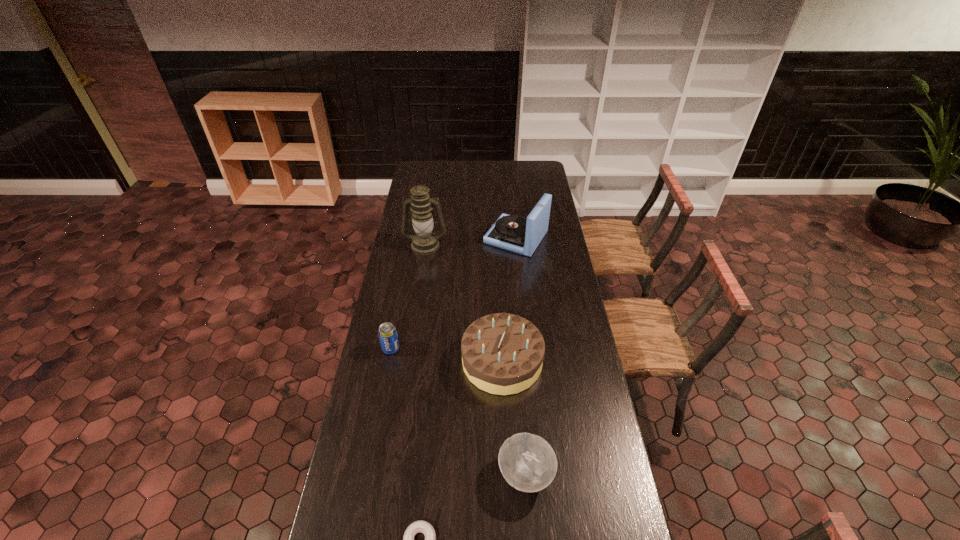
Locate an element on the screen. free space between the fifth farthest object and the third tallest object is located at coordinates (514, 418).

Identify the location of free space between the phonograph record and the third tallest object. This screenshot has width=960, height=540. (509, 300).

The image size is (960, 540). I want to click on free spot between the birthday cake and the oil lamp, so click(x=464, y=303).

In order to click on object that can be found as the closest to the bowl in this screenshot , I will do `click(421, 526)`.

Find the location of a particular element. object that stands as the fifth closest to the third shortest object is located at coordinates (514, 233).

Find the location of a particular element. This screenshot has width=960, height=540. vacant point that satisfies the following two spatial constraints: 1. on the front-facing side of the fourth shortest object; 2. on the left side of the second nearest object is located at coordinates (507, 474).

Where is `free space that satisfies the following two spatial constraints: 1. on the back side of the second tallest object; 2. on the left side of the fourth tallest object`? This screenshot has height=540, width=960. free space that satisfies the following two spatial constraints: 1. on the back side of the second tallest object; 2. on the left side of the fourth tallest object is located at coordinates (412, 238).